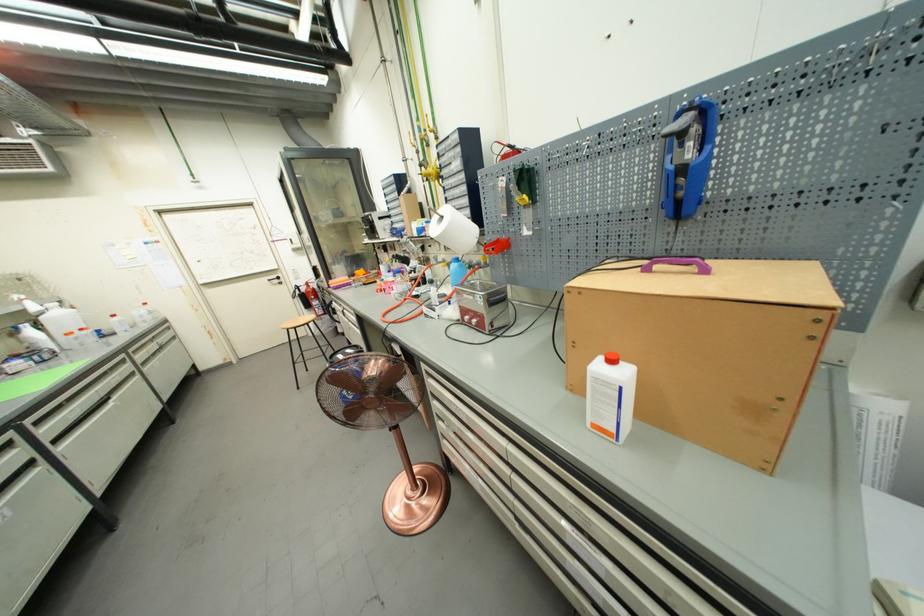
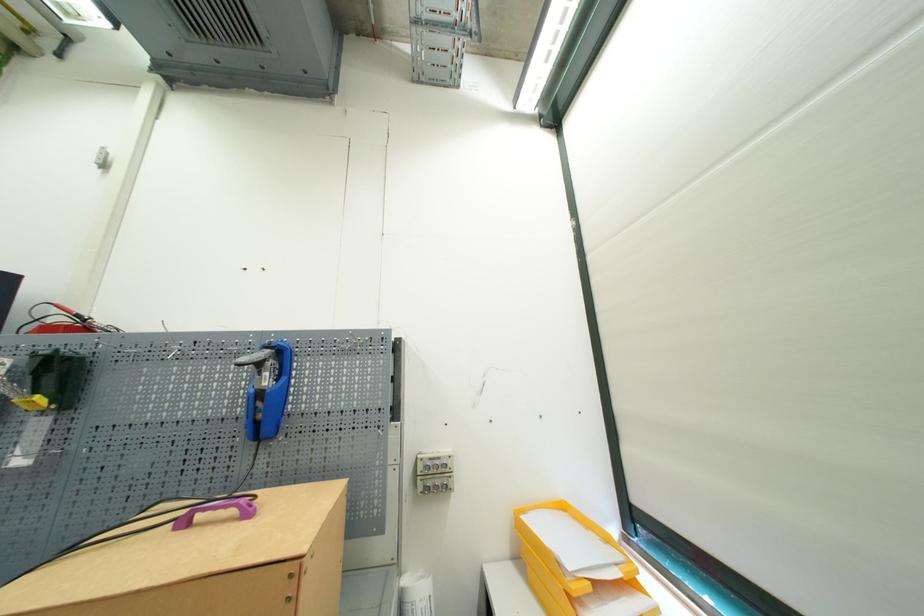
The first image is from the beginning of the video and the second image is from the end. How did the camera likely rotate when shooting the video?

The camera's rotation is toward right-up.